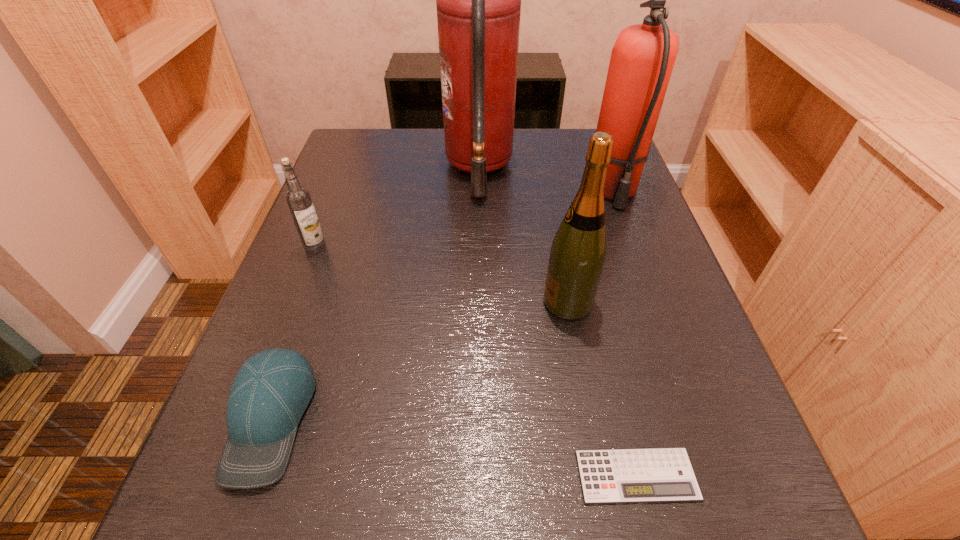
The height and width of the screenshot is (540, 960). Find the location of `the third object from left to right`. the third object from left to right is located at coordinates tap(478, 0).

The width and height of the screenshot is (960, 540). I want to click on the right fire extinguisher, so click(642, 59).

Where is `wine bottle`? Image resolution: width=960 pixels, height=540 pixels. wine bottle is located at coordinates (578, 253).

You are a GUI agent. You are given a task and a screenshot of the screen. Output one action in this format:
    pyautogui.click(x=<x>, y=<y>)
    Task: Click on the third tallest object
    
    Given the screenshot: What is the action you would take?
    pyautogui.click(x=578, y=253)

Where is `the fourth tallest object`? Image resolution: width=960 pixels, height=540 pixels. the fourth tallest object is located at coordinates (298, 198).

Image resolution: width=960 pixels, height=540 pixels. In order to click on vodka in this screenshot , I will do `click(298, 198)`.

Where is `the fifth tallest object`? The width and height of the screenshot is (960, 540). the fifth tallest object is located at coordinates (271, 391).

You are a GUI agent. You are given a task and a screenshot of the screen. Output one action in this format:
    pyautogui.click(x=<x>, y=<y>)
    Task: Click on the calculator
    The height and width of the screenshot is (540, 960).
    Given the screenshot: What is the action you would take?
    pyautogui.click(x=650, y=475)

Identify the location of vacant space located 0.060m at the front of the left fire extinguisher where the nozzle is aimed. The image size is (960, 540). (538, 168).

Image resolution: width=960 pixels, height=540 pixels. What are the coordinates of `free space located 0.390m on the nozzle of the right fire extinguisher` in the screenshot? It's located at (680, 379).